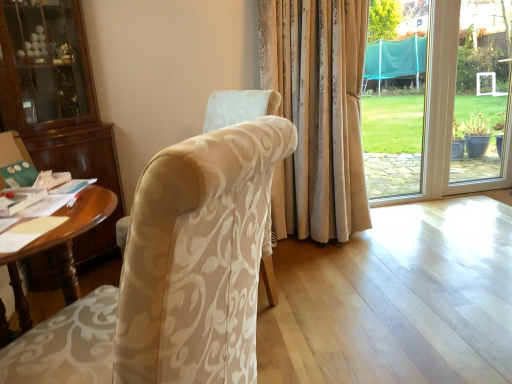
Measure the distance between point (115, 206) and camera.

Point (115, 206) and camera are 1.26 meters apart.

Consider the image. In order to face wooden desk at left, should I rotate leftwards or rightwards?

You should look left and rotate roughly 27.941 degrees.

Describe the element at coordinates (62, 246) in the screenshot. This screenshot has width=512, height=384. I see `wooden desk at left` at that location.

Find the location of a particular element. This screenshot has height=384, width=512. wooden desk at left is located at coordinates (62, 246).

What do you see at coordinates (174, 273) in the screenshot?
I see `beige damask fabric chair at center` at bounding box center [174, 273].

Locate an element on the screen. beige damask fabric chair at center is located at coordinates (174, 273).

I want to click on wooden desk at left, so click(x=62, y=246).

Can you confirm if wooden desk at left is positioned to the right of beige damask fabric chair at center?

In fact, wooden desk at left is to the left of beige damask fabric chair at center.

Considering their positions, is wooden desk at left located in front of or behind beige damask fabric chair at center?

In the image, wooden desk at left appears behind beige damask fabric chair at center.

Which point is more distant from viewer, (15,274) or (197,252)?

The point (15,274) is farther.

In the scene shown: From the image's perspective, which one is positioned lower, wooden desk at left or beige damask fabric chair at center?

wooden desk at left appears lower in the image.

From a real-world perspective, is wooden desk at left located higher than beige damask fabric chair at center?

Actually, wooden desk at left is physically below beige damask fabric chair at center in the real world.

Does wooden desk at left have a lesser width compared to beige damask fabric chair at center?

Yes.

Looking at this image, considering the relative sizes of wooden desk at left and beige damask fabric chair at center in the image provided, is wooden desk at left taller than beige damask fabric chair at center?

Incorrect, the height of wooden desk at left is not larger of that of beige damask fabric chair at center.

Which of these two, wooden desk at left or beige damask fabric chair at center, is bigger?

With larger size is wooden desk at left.

Which is correct: wooden desk at left is inside beige damask fabric chair at center, or outside of it?

The correct answer is: outside.

Looking at this image, are wooden desk at left and beige damask fabric chair at center located far from each other?

Actually, wooden desk at left and beige damask fabric chair at center are a little close together.

Is wooden desk at left oriented away from beige damask fabric chair at center?

No, wooden desk at left is not facing away from beige damask fabric chair at center.

How many degrees apart are the facing directions of wooden desk at left and beige damask fabric chair at center?

The facing directions of wooden desk at left and beige damask fabric chair at center are 145 degrees apart.

Measure the distance between wooden desk at left and beige damask fabric chair at center.

The distance of wooden desk at left from beige damask fabric chair at center is 16.44 inches.

In the image, there is a wooden desk at left. At what (x,y) coordinates should I click in order to perform the action: click on chair above it (from the image's perspective). Please return your answer as a coordinate pair (x, y). Image resolution: width=512 pixels, height=384 pixels. Looking at the image, I should click on [x=174, y=273].

Between beige damask fabric chair at center and wooden desk at left, which one appears on the left side from the viewer's perspective?

From the viewer's perspective, wooden desk at left appears more on the left side.

Relative to wooden desk at left, is beige damask fabric chair at center in front or behind?

beige damask fabric chair at center is in front of wooden desk at left.

Is point (167, 183) farther from viewer compared to point (70, 254)?

No, (167, 183) is in front of (70, 254).

From the image's perspective, who appears lower, beige damask fabric chair at center or wooden desk at left?

wooden desk at left, from the image's perspective.

From a real-world perspective, which object stands above the other?

beige damask fabric chair at center.

Considering the sizes of beige damask fabric chair at center and wooden desk at left in the image, is beige damask fabric chair at center wider or thinner than wooden desk at left?

In the image, beige damask fabric chair at center appears to be wider than wooden desk at left.

Can you confirm if beige damask fabric chair at center is shorter than wooden desk at left?

In fact, beige damask fabric chair at center may be taller than wooden desk at left.

Considering the sizes of objects beige damask fabric chair at center and wooden desk at left in the image provided, who is smaller, beige damask fabric chair at center or wooden desk at left?

Smaller between the two is beige damask fabric chair at center.

Is beige damask fabric chair at center inside or outside of wooden desk at left?

beige damask fabric chair at center exists outside the volume of wooden desk at left.

Based on the photo, is beige damask fabric chair at center not near wooden desk at left?

No.

Is beige damask fabric chair at center aimed at wooden desk at left?

Yes, beige damask fabric chair at center faces towards wooden desk at left.

How far apart are beige damask fabric chair at center and wooden desk at left?

They are 16.44 inches apart.

This screenshot has width=512, height=384. Identify the location of chair above the wooden desk at left (from a real-world perspective). (174, 273).

Where is `desk that is below the beige damask fabric chair at center (from the image's perspective)`? The image size is (512, 384). desk that is below the beige damask fabric chair at center (from the image's perspective) is located at coordinates (62, 246).

The width and height of the screenshot is (512, 384). In order to click on desk behind the beige damask fabric chair at center in this screenshot , I will do `click(62, 246)`.